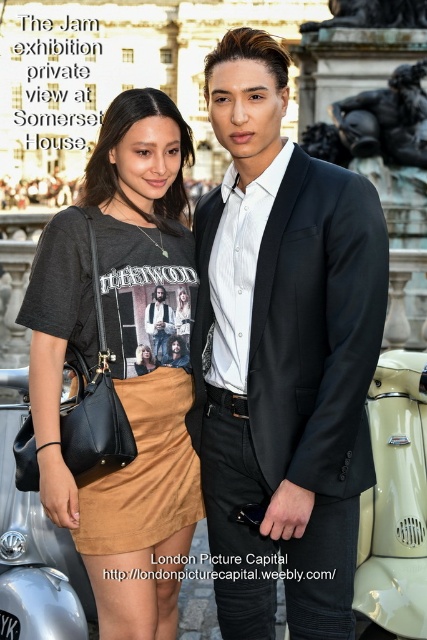
You are standing at point [164,289] and want to move to the historic building in the background. Is the point [327,205] blocking your path?

Point [327,205] is in front of point [164,289], so moving from point [164,289] towards the historic building in the background would require navigating around point [327,205] as it is blocking the direct path.